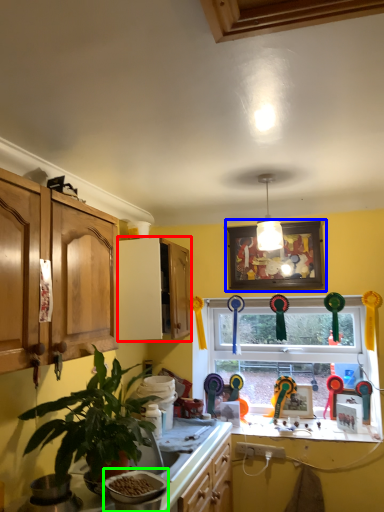
Question: Estimate the real-world distances between objects in this image. Which object is closer to cabinetry (highlighted by a red box), picture frame (highlighted by a blue box) or appliance (highlighted by a green box)?

Choices:
 (A) picture frame
 (B) appliance

Answer: (A)